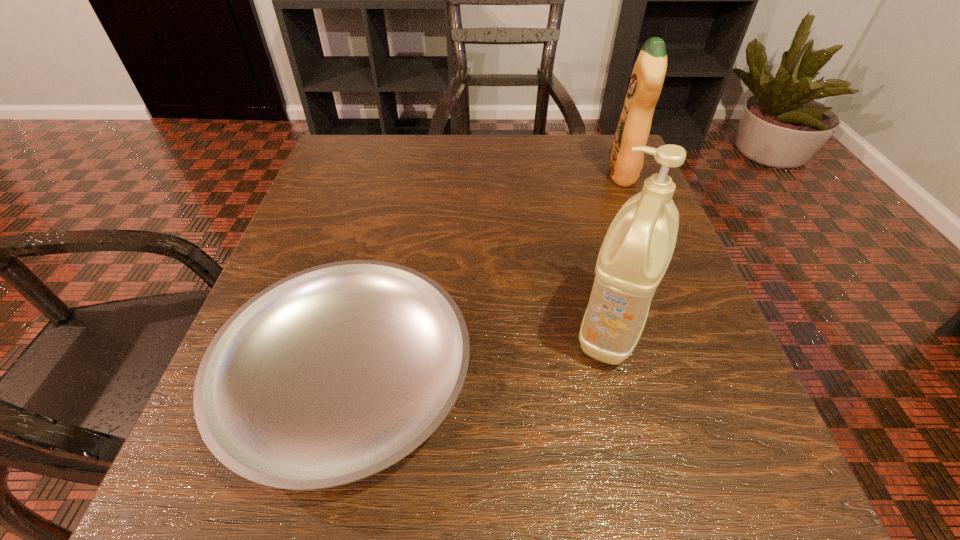
In order to click on the rightmost object in this screenshot , I will do `click(648, 75)`.

Find the location of a particular element. the farthest object is located at coordinates (648, 75).

Where is `the left detergent`? the left detergent is located at coordinates (637, 249).

The width and height of the screenshot is (960, 540). In order to click on the nearer detergent in this screenshot , I will do `click(637, 249)`.

Locate an element on the screen. the shortest object is located at coordinates (330, 375).

The image size is (960, 540). Find the location of `the leftmost object`. the leftmost object is located at coordinates pyautogui.click(x=330, y=375).

This screenshot has height=540, width=960. Identify the location of free space located on the label of the rightmost object. (480, 174).

You are a GUI agent. You are given a task and a screenshot of the screen. Output one action in this format:
    pyautogui.click(x=<x>, y=<y>)
    Task: Click on the free space located on the label of the rightmost object
    
    Given the screenshot: What is the action you would take?
    pyautogui.click(x=580, y=174)

Find the location of a particular element. This screenshot has height=540, width=960. vacant region located on the label of the rightmost object is located at coordinates (444, 174).

Where is `vacant space situated 0.080m on the right of the nearer detergent`? The width and height of the screenshot is (960, 540). vacant space situated 0.080m on the right of the nearer detergent is located at coordinates (704, 329).